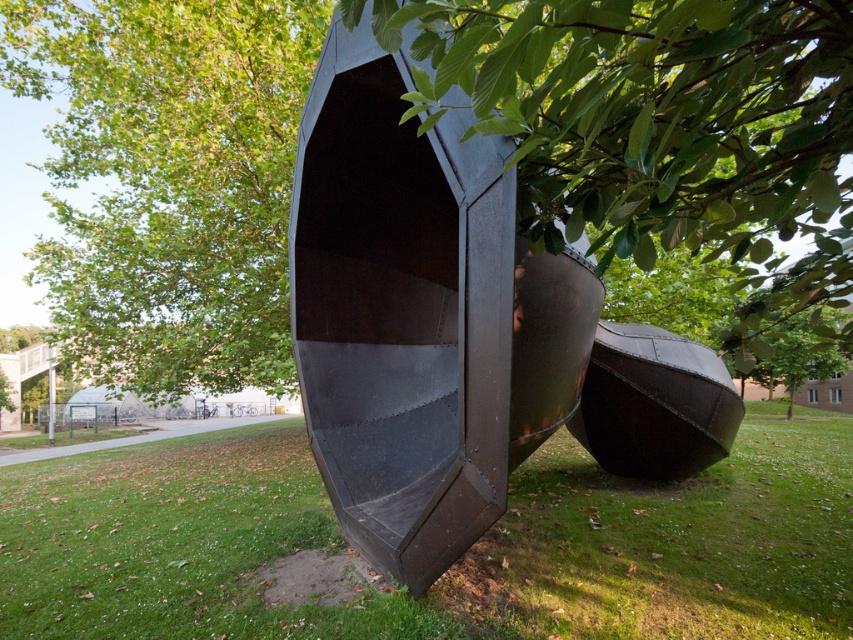
Who is shorter, green grass at lower center or matte black boat at center?

green grass at lower center is shorter.

Does green grass at lower center appear over matte black boat at center?

No, green grass at lower center is not above matte black boat at center.

Which is behind, point (4, 586) or point (659, 387)?

The point (659, 387) is behind.

The image size is (853, 640). Find the location of `green grass at lower center`. green grass at lower center is located at coordinates (451, 564).

Which is more to the right, green leafy tree at upper left or matte black boat at center?

Positioned to the right is matte black boat at center.

Which is above, green leafy tree at upper left or matte black boat at center?

green leafy tree at upper left is higher up.

Who is more distant from viewer, [161,237] or [641,358]?

Positioned behind is point [161,237].

You are a GUI agent. You are given a task and a screenshot of the screen. Output one action in this format:
    pyautogui.click(x=<x>, y=<y>)
    Task: Click on the green leafy tree at upper left
    Image resolution: width=853 pixels, height=640 pixels.
    Given the screenshot: What is the action you would take?
    pyautogui.click(x=169, y=180)

Does point (666, 547) come closer to viewer compared to point (827, 253)?

That is False.

Locate an element on the screen. green grass at lower center is located at coordinates (451, 564).